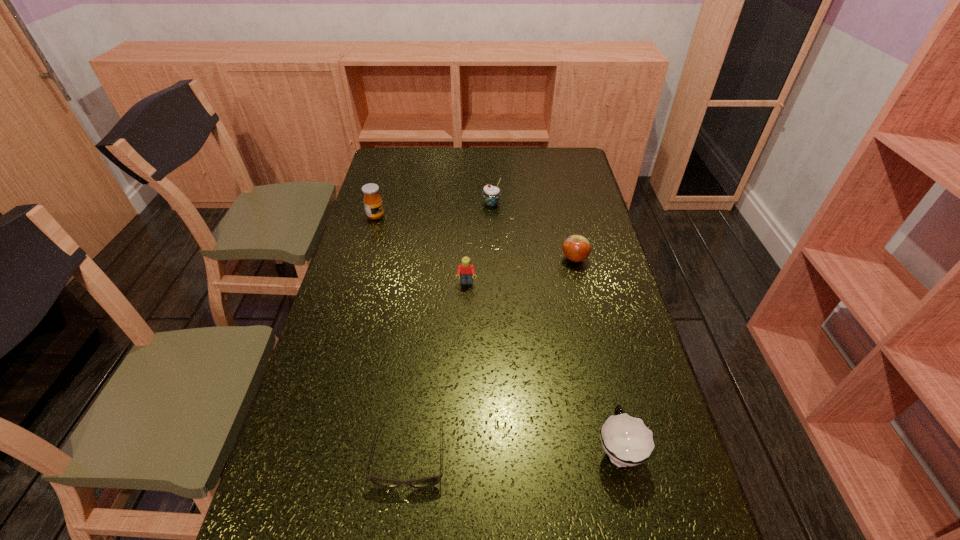
You are a GUI agent. You are given a task and a screenshot of the screen. Output one action in this format:
    pyautogui.click(x=<x>, y=<y>)
    Task: Click on the vacant area situated 0.210m on the front-facing side of the honey
    The width and height of the screenshot is (960, 540).
    Given the screenshot: What is the action you would take?
    (442, 216)

You are a GUI agent. You are given a task and a screenshot of the screen. Output one action in this format:
    pyautogui.click(x=<x>, y=<y>)
    Task: Click on the vacant point located on the front of the third object from right to left
    The width and height of the screenshot is (960, 540).
    Given the screenshot: What is the action you would take?
    pyautogui.click(x=493, y=264)

This screenshot has width=960, height=540. Identify the location of free space located on the face of the fourth farthest object. [x=466, y=306].

Find the location of a particular element. The image size is (960, 540). vacant space located 0.270m on the side of the cup with the handle is located at coordinates (590, 332).

Where is `vacant space located on the side of the cup with the handle`? The width and height of the screenshot is (960, 540). vacant space located on the side of the cup with the handle is located at coordinates (603, 388).

At what (x,y) coordinates should I click in order to perform the action: click on vacant area situated 0.340m on the side of the cup with the handle. Please return your answer as a coordinate pair (x, y). Looking at the image, I should click on (587, 313).

The width and height of the screenshot is (960, 540). What are the coordinates of `vacant space located on the left of the apple` in the screenshot? It's located at (509, 259).

You are a GUI agent. You are given a task and a screenshot of the screen. Output one action in this format:
    pyautogui.click(x=<x>, y=<y>)
    Task: Click on the object at the left edge
    
    Given the screenshot: What is the action you would take?
    pyautogui.click(x=372, y=200)

Where is `cup that is at the right edge`? The width and height of the screenshot is (960, 540). cup that is at the right edge is located at coordinates (627, 441).

At what (x,y) coordinates should I click in order to perform the action: click on apple that is at the right edge. Please return your answer as a coordinate pair (x, y). The height and width of the screenshot is (540, 960). Looking at the image, I should click on (576, 248).